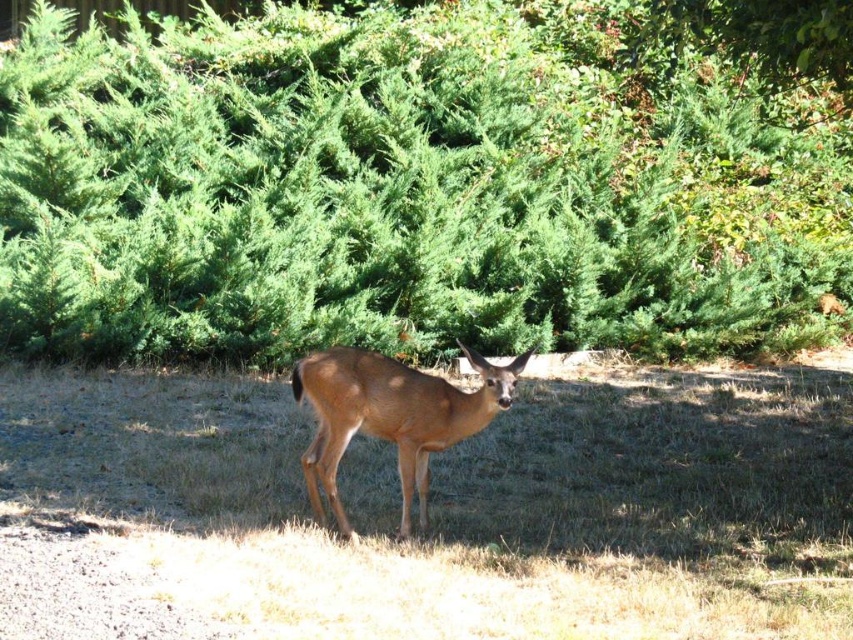
Question: Among these points, which one is farthest from the camera?

Choices:
 (A) (49, 570)
 (B) (805, 316)
 (C) (444, 420)

Answer: (B)

Question: Which point is farther from the camera taking this photo?

Choices:
 (A) (625, 541)
 (B) (354, 352)

Answer: (A)

Question: Does brown dry grass at center have a lesser width compared to brown matte/deer at center?

Choices:
 (A) no
 (B) yes

Answer: (B)

Question: Is brown dry grass at center wider than brown matte/deer at center?

Choices:
 (A) yes
 (B) no

Answer: (B)

Question: Among these objects, which one is nearest to the camera?

Choices:
 (A) brown dry grass at center
 (B) brown matte/deer at center

Answer: (A)

Question: Is green leafy bush at center smaller than brown dry grass at center?

Choices:
 (A) yes
 (B) no

Answer: (B)